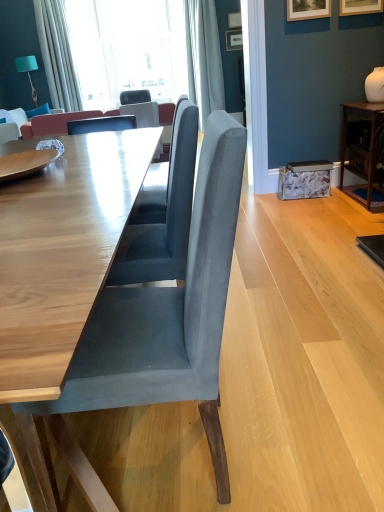
The image size is (384, 512). Identify the location of unoccupied region to the right of wooden table at center, which is the 2th table from right to left. (262, 331).